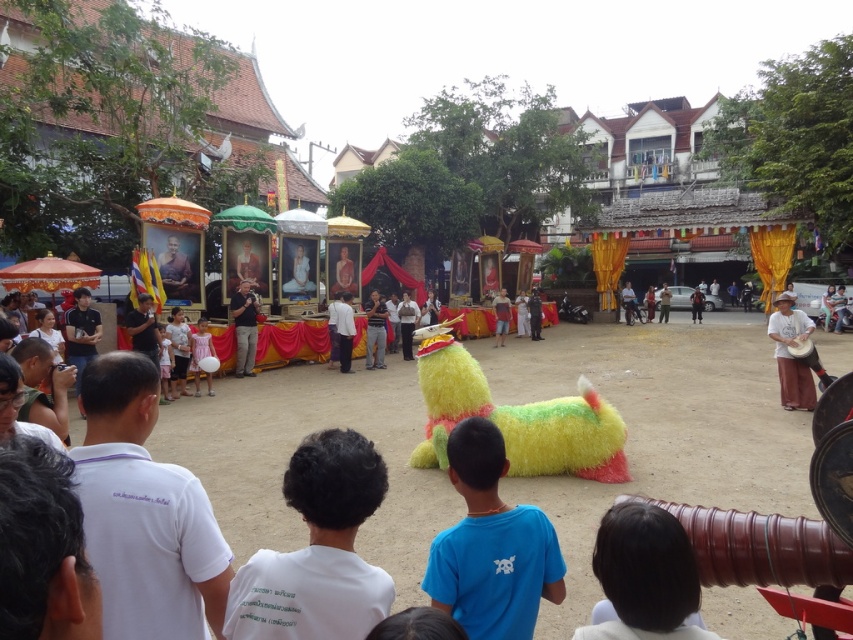
Can you confirm if blue fuzzy shirt at center is bigger than black matte shirt at center?

Yes, blue fuzzy shirt at center is bigger than black matte shirt at center.

Does blue fuzzy shirt at center come in front of black matte shirt at center?

Yes, it is in front of black matte shirt at center.

This screenshot has height=640, width=853. I want to click on blue fuzzy shirt at center, so click(491, 545).

Can you confirm if white matte shirt at lower left is positioned to the right of blue fuzzy shirt at center?

No, white matte shirt at lower left is not to the right of blue fuzzy shirt at center.

Is white matte shirt at lower left above blue fuzzy shirt at center?

Yes.

Is point (274, 611) less distant than point (467, 484)?

Yes, point (274, 611) is in front of point (467, 484).

The height and width of the screenshot is (640, 853). In order to click on white matte shirt at lower left in this screenshot , I will do `click(317, 550)`.

Is point (795, 364) behind point (202, 328)?

That is False.

Is white cotton hat at right further to the viewer compared to pink satin dress at center?

That is False.

Is point (798, 317) in front of point (195, 352)?

Yes, point (798, 317) is closer to viewer.

At what (x,y) coordinates should I click in order to perform the action: click on white cotton hat at right. Please return your answer as a coordinate pair (x, y). The height and width of the screenshot is (640, 853). Looking at the image, I should click on (791, 355).